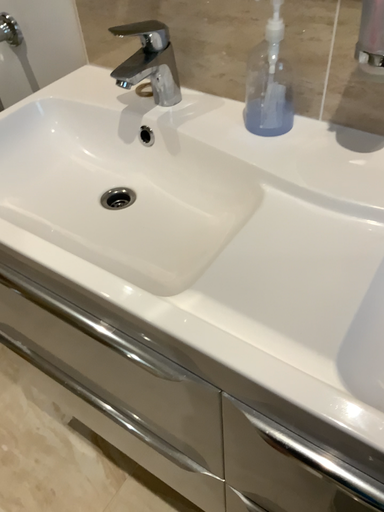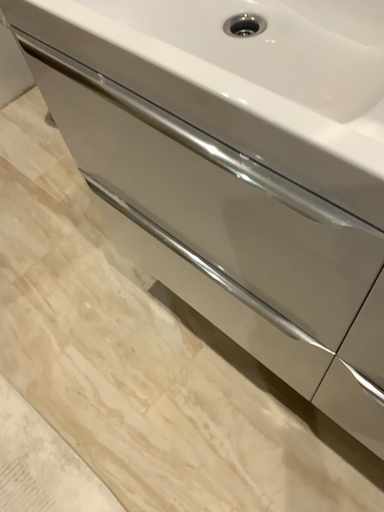
Question: Which way did the camera rotate in the video?

Choices:
 (A) rotated right
 (B) rotated left

Answer: (B)